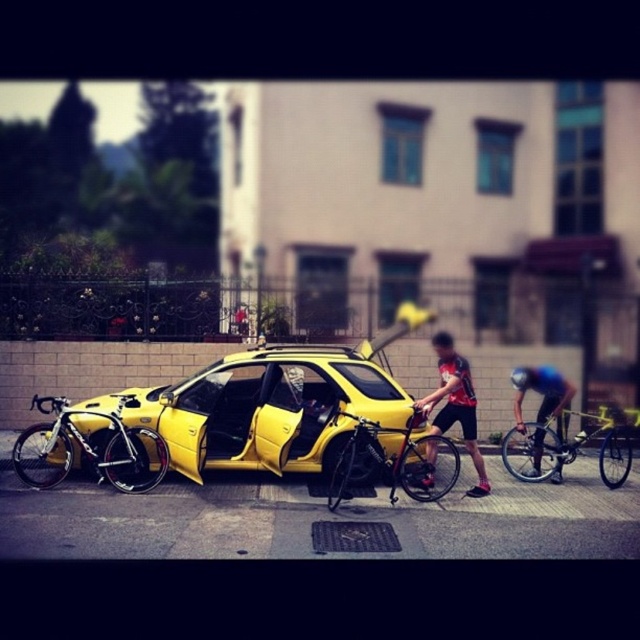
You are a delivery person who needs to load a package onto the yellow matte car at center. The package is taller than the shiny black bicycle at center. Can you fit it on top of the car without exceeding the height limit?

The yellow matte car at center is taller than the shiny black bicycle at center. Since the package is taller than the bicycle, it might still fit on the car if the car has enough clearance. However, without knowing the exact height of the package relative to the car, it is uncertain. The car is taller than the bicycle, but the package could still exceed the car height if it surpasses the car dimensions.

You are a delivery person who needs to carry both the yellow matte bicycle at center and the black matte bicycle helmet at center in your vehicle. Which item should you place first in the trunk to ensure they both fit?

The yellow matte bicycle at center is bigger than the black matte bicycle helmet at center, so you should place the yellow matte bicycle at center first in the trunk to accommodate its larger size before placing the smaller helmet.